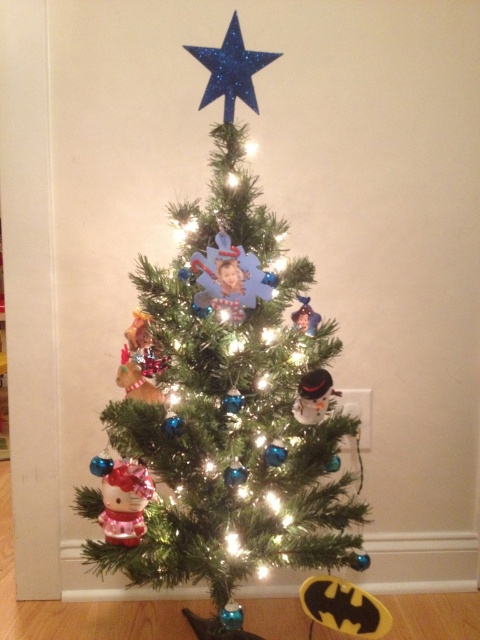
You are standing in front of the Christmas tree and see two points marked on the tree. The first point is at coordinates point (x=111, y=477) and the second is at point (x=305, y=332). Which point is closer to you?

Point (x=111, y=477) is in front of point (x=305, y=332), so the first point is closer to you.

You are a child looking at the Christmas tree. You want to reach the glittery blue star at top to touch it. Can you reach it by standing on the metallic silver ornament at center?

The glittery blue star at top is above the metallic silver ornament at center, so standing on the metallic silver ornament at center would not help you reach the glittery blue star at top because it is already positioned below it.